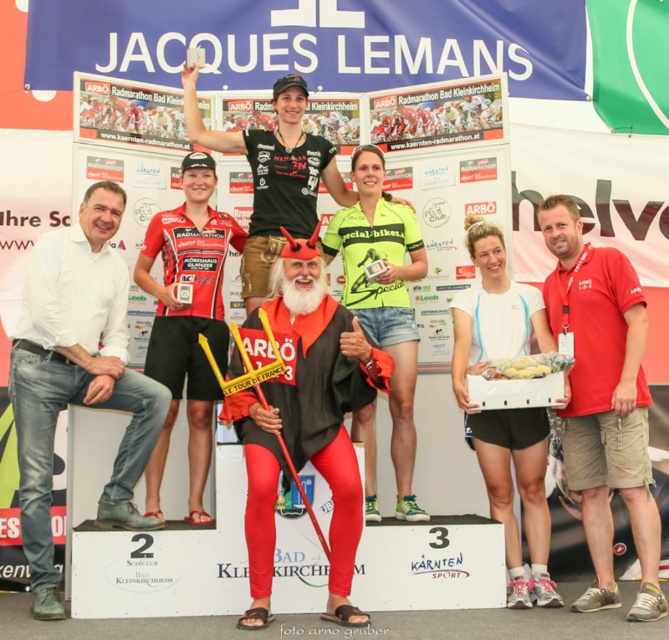
You are a photographer at the event and want to take a photo that includes both the red matte devil costume at center and the red cotton shirt at right. Which object should you focus on first to ensure both are in frame?

The red matte devil costume at center is closer to the viewer than the red cotton shirt at right, so focus on the red matte devil costume at center first to ensure both are in frame.

You are organizing a costume party and need to decide which costume takes more space horizontally. Based on the image, which between the red matte devil costume at center and the red cotton shirt at right is wider?

The red matte devil costume at center is wider than the red cotton shirt at right as per the description provided.